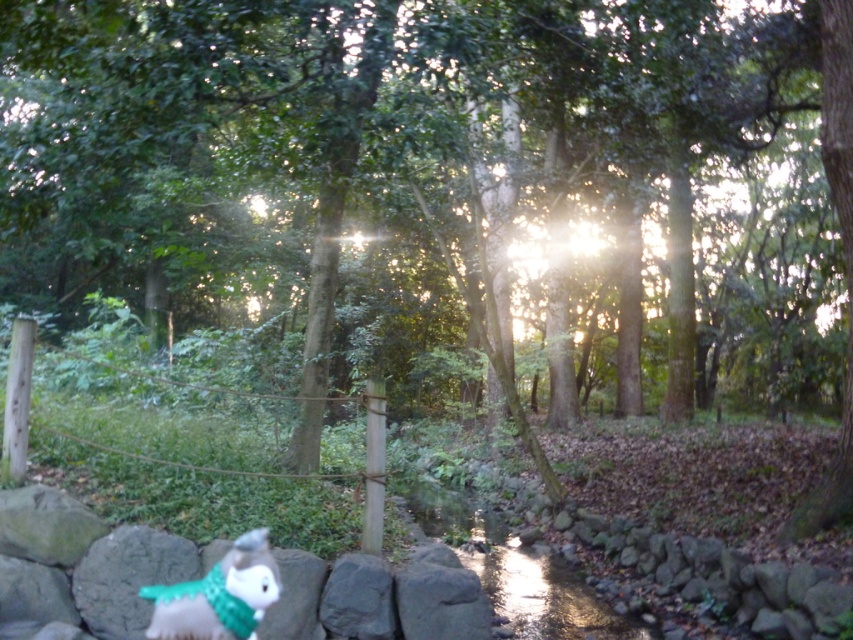
Who is lower down, ropewooden post at center or shiny metallic creek at center?

shiny metallic creek at center is lower down.

Is ropewooden post at center to the left of shiny metallic creek at center from the viewer's perspective?

Yes, ropewooden post at center is to the left of shiny metallic creek at center.

Which is behind, point (160, 422) or point (548, 579)?

Point (548, 579)

The image size is (853, 640). I want to click on ropewooden post at center, so click(x=190, y=472).

Is point (544, 620) closer to viewer compared to point (178, 588)?

No, (544, 620) is further to viewer.

This screenshot has height=640, width=853. In order to click on shiny metallic creek at center in this screenshot , I will do `click(517, 572)`.

The height and width of the screenshot is (640, 853). Find the location of `shiny metallic creek at center`. shiny metallic creek at center is located at coordinates [517, 572].

Can you confirm if ropewooden post at center is smaller than fluffy gray stuffed animal at lower left?

No, ropewooden post at center is not smaller than fluffy gray stuffed animal at lower left.

Which of these two, ropewooden post at center or fluffy gray stuffed animal at lower left, stands shorter?

Standing shorter between the two is fluffy gray stuffed animal at lower left.

Does point (42, 417) lie in front of point (201, 636)?

No, (42, 417) is behind (201, 636).

The width and height of the screenshot is (853, 640). I want to click on ropewooden post at center, so [x=190, y=472].